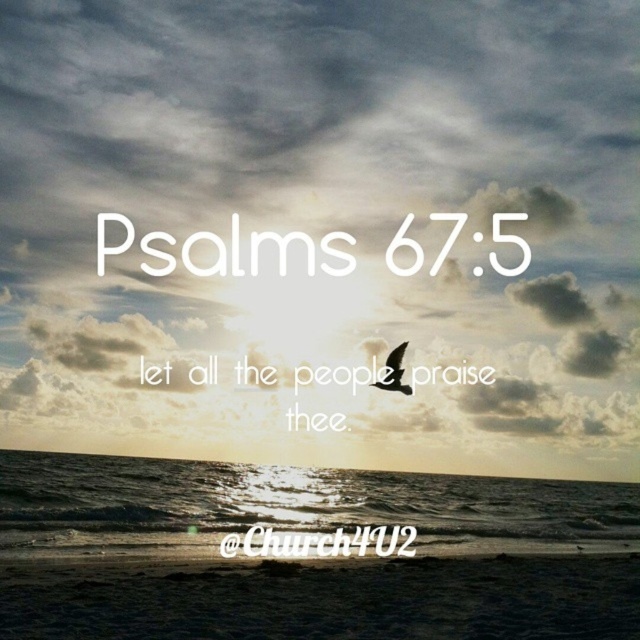
Question: Which point is closer to the camera?

Choices:
 (A) (394, 355)
 (B) (458, 513)

Answer: (A)

Question: Can you confirm if cloudy sky at upper center is positioned to the left of matte black bird at center?

Choices:
 (A) yes
 (B) no

Answer: (A)

Question: Can you confirm if cloudy sky at upper center is positioned below glistening water at lower center?

Choices:
 (A) yes
 (B) no

Answer: (B)

Question: Among these points, which one is farthest from the camera?

Choices:
 (A) (188, 83)
 (B) (403, 385)

Answer: (A)

Question: Does glistening water at lower center appear under matte black bird at center?

Choices:
 (A) no
 (B) yes

Answer: (B)

Question: Among these objects, which one is nearest to the camera?

Choices:
 (A) matte black bird at center
 (B) glistening water at lower center
 (C) cloudy sky at upper center

Answer: (C)